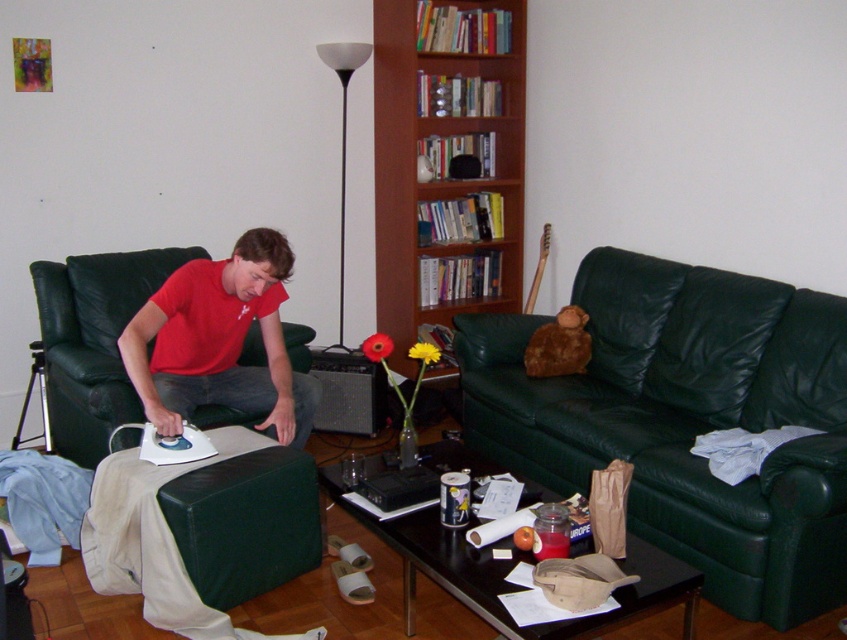
You are a guest in the living room and want to place a matte red shirt at center on the green leather couch at center. Can you do this without needing to adjust the couch?

The green leather couch at center is taller than matte red shirt at center, so yes, you can place the matte red shirt at center on the green leather couch at center without needing to adjust the couch.

You are a guest in this living room and want to sit down. The host offers you a choice between the green leather couch at center and the wooden bookshelf at center. Which one is more suitable for sitting?

The green leather couch at center is more suitable for sitting because it is larger in size than the wooden bookshelf at center, making it a more comfortable seating option.